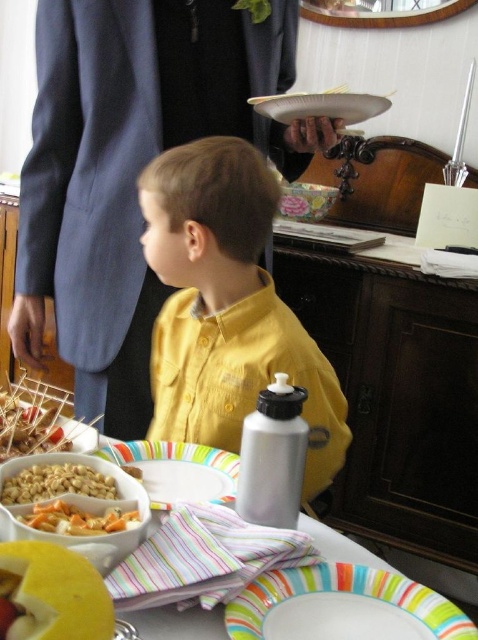
Question: Which point appears closest to the camera in this image?

Choices:
 (A) (301, 557)
 (B) (45, 632)
 (C) (11, 484)
 (D) (216, 316)

Answer: (B)

Question: Which of these objects is positioned closest to the yellowish-orange fruit at lower left?

Choices:
 (A) crumbly brown cookie at left
 (B) white paper plate at upper center
 (C) carrot salad at lower left
 (D) white crunchy nuts at lower left

Answer: (C)

Question: Can you confirm if yellow matte shirt at center is positioned below white paper plate at upper center?

Choices:
 (A) yes
 (B) no

Answer: (A)

Question: Does yellow matte shirt at center appear under white paper plate at center?

Choices:
 (A) yes
 (B) no

Answer: (B)

Question: Can you confirm if yellowish-orange fruit at lower left is positioned above white paper plate at upper center?

Choices:
 (A) yes
 (B) no

Answer: (B)

Question: Which point is farther to the camera?

Choices:
 (A) (94, 468)
 (B) (126, 516)
 (C) (181, 472)

Answer: (C)